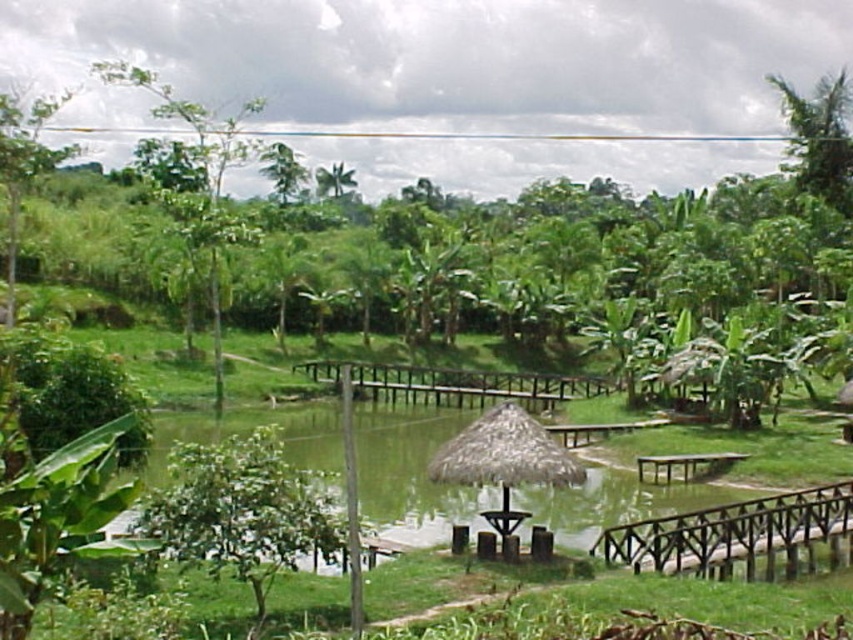
Question: Does brown wooden bridge at center appear on the left side of green leafy palm at upper right?

Choices:
 (A) yes
 (B) no

Answer: (A)

Question: Which point is farther from the camera taking this photo?

Choices:
 (A) (289, 150)
 (B) (639, 467)

Answer: (A)

Question: Is green leafy tree at upper left bigger than green wooden picnic table at lower right?

Choices:
 (A) no
 (B) yes

Answer: (B)

Question: Can you confirm if brown wooden bridge at lower right is smaller than green leafy palm at upper right?

Choices:
 (A) no
 (B) yes

Answer: (B)

Question: Which object appears closest to the camera in this image?

Choices:
 (A) green leafy palm at upper right
 (B) green leafy tree at upper center
 (C) green leafy tree at lower left
 (D) green leafy tree at upper left

Answer: (C)

Question: Among these objects, which one is nearest to the camera?

Choices:
 (A) green leafy tree at upper center
 (B) brown wooden bridge at lower right
 (C) green leafy palm at upper center

Answer: (B)